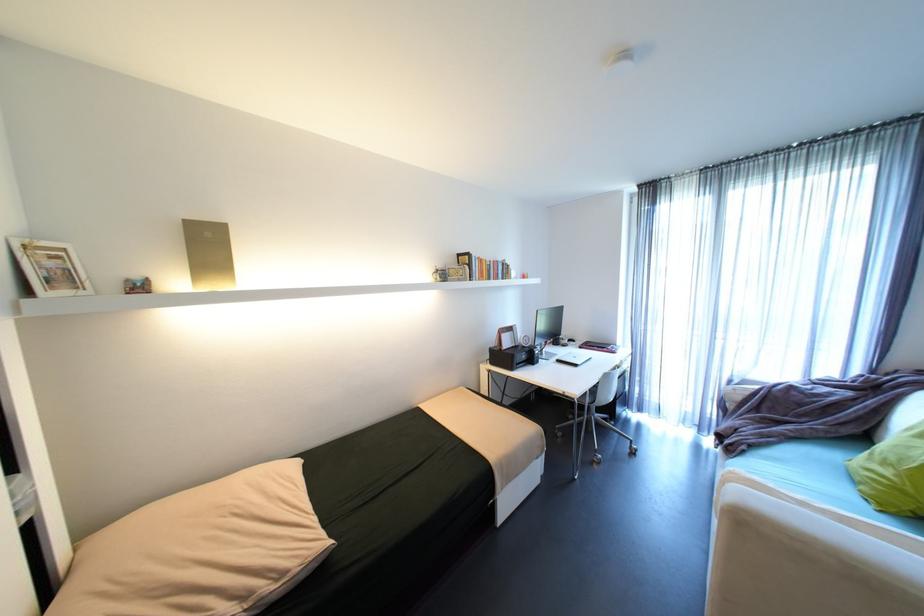
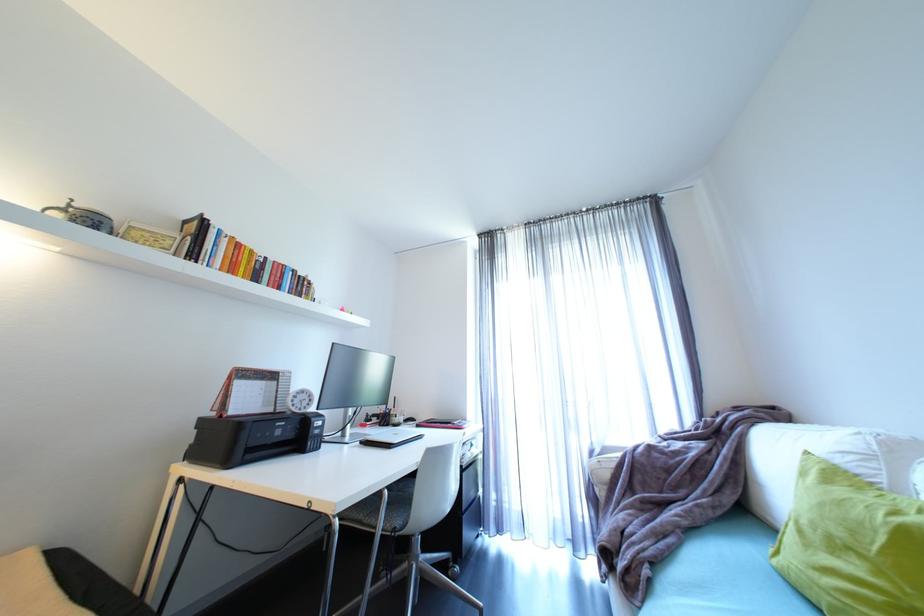
Locate, in the second image, the point that corresponds to pixel 599 347 in the first image.

(440, 424)